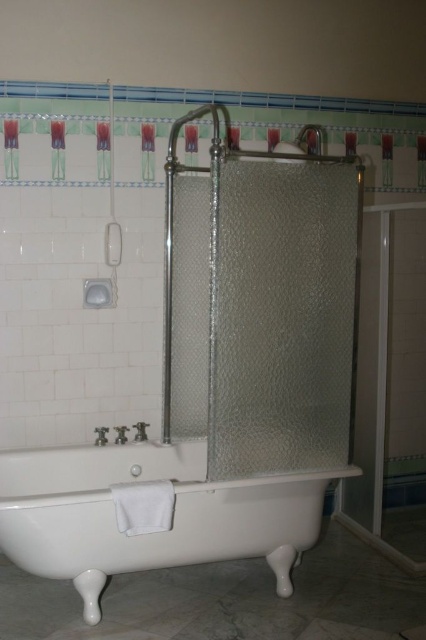
Can you confirm if white glossy bathtub at lower center is smaller than clear glass shower at upper center?

No.

Can you confirm if white glossy bathtub at lower center is bigger than clear glass shower at upper center?

Correct, white glossy bathtub at lower center is larger in size than clear glass shower at upper center.

This screenshot has height=640, width=426. I want to click on white glossy bathtub at lower center, so click(152, 532).

I want to click on white glossy bathtub at lower center, so click(152, 532).